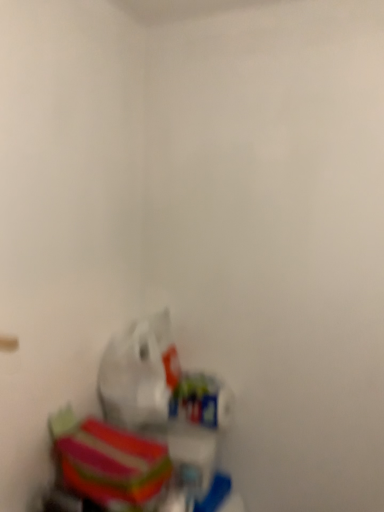
I want to click on translucent white plastic bag at center, so click(x=139, y=373).

This screenshot has height=512, width=384. What do you see at coordinates (139, 373) in the screenshot? I see `translucent white plastic bag at center` at bounding box center [139, 373].

The height and width of the screenshot is (512, 384). I want to click on translucent white plastic bag at center, so click(139, 373).